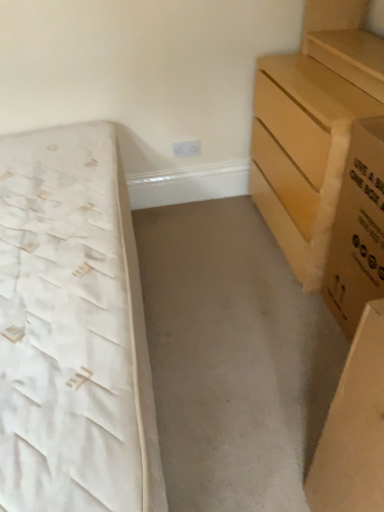
Describe the element at coordinates (310, 137) in the screenshot. I see `light brown wooden chest of drawers at right` at that location.

The height and width of the screenshot is (512, 384). Find the location of `light brown wooden chest of drawers at right`. light brown wooden chest of drawers at right is located at coordinates (310, 137).

From a real-world perspective, who is located lower, white fabric bed at left or brown cardboard box at right?

white fabric bed at left is physically lower.

Is white fabric bed at left wider than brown cardboard box at right?

Correct, the width of white fabric bed at left exceeds that of brown cardboard box at right.

Is white fabric bed at left turned away from brown cardboard box at right?

No, white fabric bed at left's orientation is not away from brown cardboard box at right.

Is light brown wooden chest of drawers at right situated inside white fabric bed at left or outside?

The correct answer is: outside.

Is light brown wooden chest of drawers at right facing away from white fabric bed at left?

No, white fabric bed at left is not at the back of light brown wooden chest of drawers at right.

Which object is closer to the camera, light brown wooden chest of drawers at right or white fabric bed at left?

white fabric bed at left.

Which of these two, light brown wooden chest of drawers at right or white fabric bed at left, is smaller?

With smaller size is light brown wooden chest of drawers at right.

Which is correct: brown cardboard box at right is inside light brown wooden chest of drawers at right, or outside of it?

brown cardboard box at right is located beyond the bounds of light brown wooden chest of drawers at right.

How many degrees apart are the facing directions of brown cardboard box at right and light brown wooden chest of drawers at right?

There is a 1.47-degree angle between the facing directions of brown cardboard box at right and light brown wooden chest of drawers at right.

Which object is positioned more to the left, brown cardboard box at right or light brown wooden chest of drawers at right?

light brown wooden chest of drawers at right is more to the left.

Based on the photo, from a real-world perspective, which is physically below, white fabric bed at left or light brown wooden chest of drawers at right?

From a 3D spatial view, white fabric bed at left is below.

Consider the image. Does white fabric bed at left have a greater width compared to light brown wooden chest of drawers at right?

Correct, the width of white fabric bed at left exceeds that of light brown wooden chest of drawers at right.

Which is behind, white fabric bed at left or light brown wooden chest of drawers at right?

light brown wooden chest of drawers at right is further away from the camera.

Does point (353, 240) come in front of point (79, 376)?

No, it is not.

Is the position of brown cardboard box at right less distant than that of white fabric bed at left?

No, it is not.

Considering the positions of objects brown cardboard box at right and white fabric bed at left in the image provided, who is more to the right, brown cardboard box at right or white fabric bed at left?

brown cardboard box at right is more to the right.

Could you tell me if light brown wooden chest of drawers at right is turned towards brown cardboard box at right?

No.

From a real-world perspective, does light brown wooden chest of drawers at right stand above brown cardboard box at right?

Yes, from a real-world perspective, light brown wooden chest of drawers at right is above brown cardboard box at right.

Considering the positions of objects light brown wooden chest of drawers at right and brown cardboard box at right in the image provided, who is in front, light brown wooden chest of drawers at right or brown cardboard box at right?

brown cardboard box at right is closer to the camera.

Is brown cardboard box at right inside light brown wooden chest of drawers at right?

No.

Locate an element on the screen. The width and height of the screenshot is (384, 512). cardboard box above the white fabric bed at left (from the image's perspective) is located at coordinates (358, 229).

Locate an element on the screen. The width and height of the screenshot is (384, 512). bed in front of the light brown wooden chest of drawers at right is located at coordinates (72, 330).

Estimate the real-world distances between objects in this image. Which object is closer to brown cardboard box at right, white fabric bed at left or light brown wooden chest of drawers at right?

light brown wooden chest of drawers at right.

Which object lies nearer to the anchor point light brown wooden chest of drawers at right, brown cardboard box at right or white fabric bed at left?

brown cardboard box at right lies closer to light brown wooden chest of drawers at right than the other object.

Based on their spatial positions, is light brown wooden chest of drawers at right or brown cardboard box at right further from white fabric bed at left?

brown cardboard box at right.

Estimate the real-world distances between objects in this image. Which object is closer to light brown wooden chest of drawers at right, white fabric bed at left or brown cardboard box at right?

Among the two, brown cardboard box at right is located nearer to light brown wooden chest of drawers at right.

Looking at the image, which one is located closer to brown cardboard box at right, light brown wooden chest of drawers at right or white fabric bed at left?

light brown wooden chest of drawers at right lies closer to brown cardboard box at right than the other object.

When comparing their distances from white fabric bed at left, does brown cardboard box at right or light brown wooden chest of drawers at right seem closer?

Based on the image, light brown wooden chest of drawers at right appears to be nearer to white fabric bed at left.

Locate an element on the screen. the chest of drawers situated between white fabric bed at left and brown cardboard box at right from left to right is located at coordinates (310, 137).